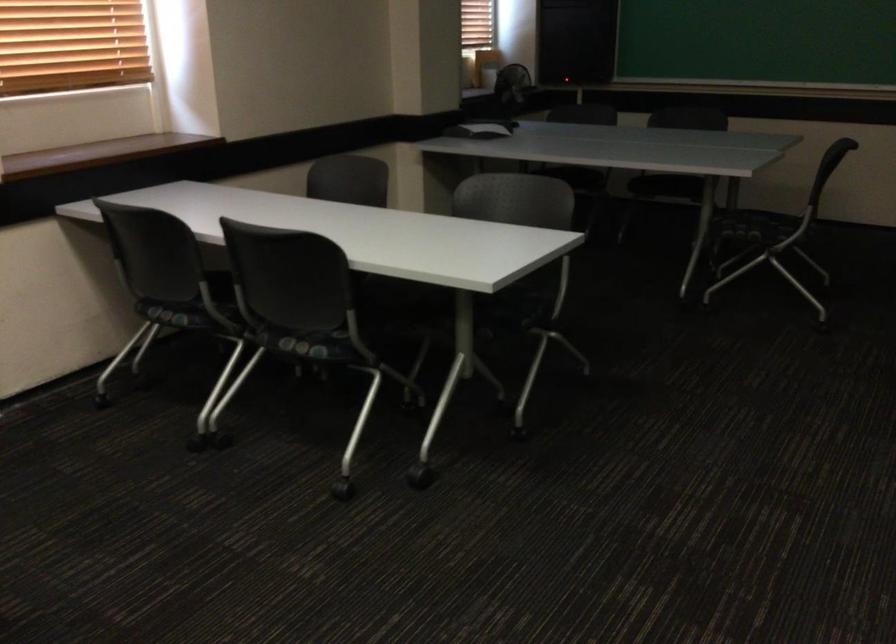
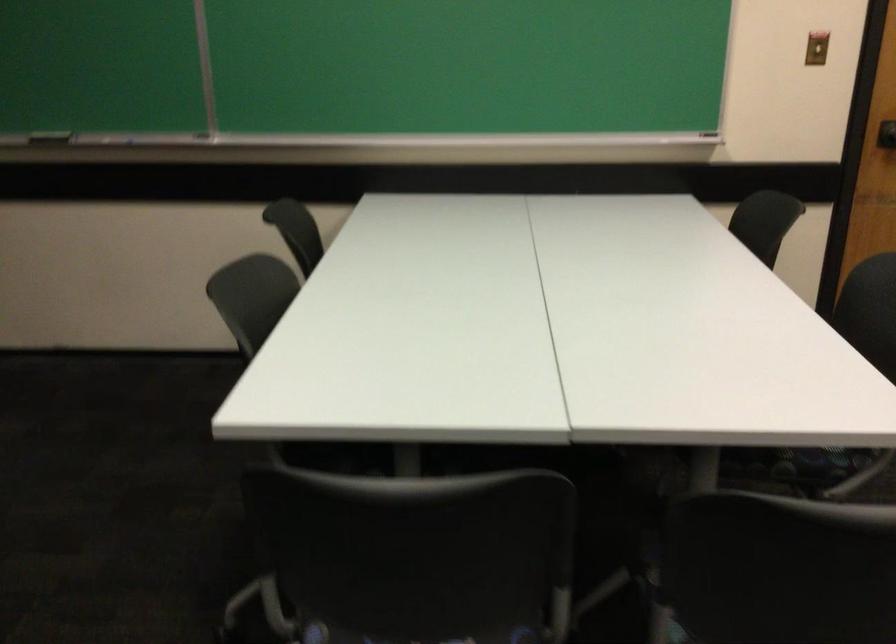
In the scene shown: Based on the continuous images, in which direction is the camera rotating?

The camera rotated toward right-down.